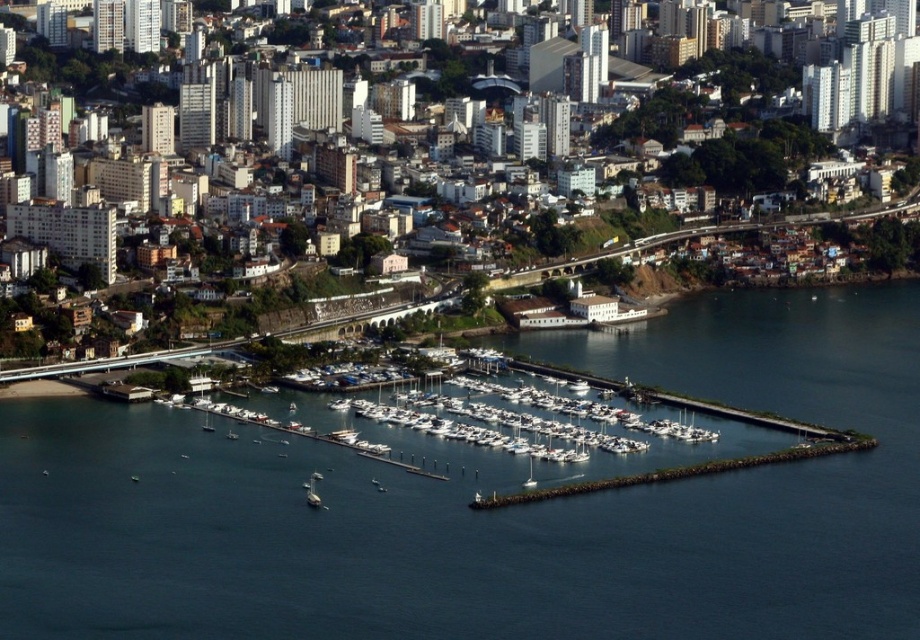
You are a photographer planning to capture the white matte boats at center and the white matte boat at lower center in a single shot. Considering their heights, which boat will appear taller in your photo?

The white matte boats at center will appear taller in the photo since it has a greater height compared to the white matte boat at lower center according to the description.

You are a drone operator flying a drone over the urban waterfront area. Your drone is currently at point A, which is at coordinates point [823,628], and you need to fly it to point B, located at point [314,484]. Considering the aerial view provided, will the drone have a clear path to fly directly between these two points without any obstructions?

Point [823,628] is in front of point [314,484], so the drone will have a clear path to fly directly between these two points without any obstructions.

You are a photographer planning to capture a wide shot of the waterfront area. Given that the dark blue water at center and the white matte boats at center are both in your frame, which object would occupy more of the visual space in your photo?

The dark blue water at center is larger in size than the white matte boats at center, so it would occupy more visual space in the photo.